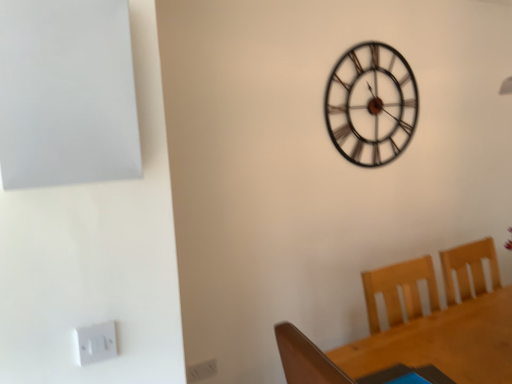
Question: Considering the relative positions of metallic black clock at upper center and white plastic electric outlet at lower left in the image provided, is metallic black clock at upper center to the left of white plastic electric outlet at lower left from the viewer's perspective?

Choices:
 (A) yes
 (B) no

Answer: (B)

Question: From the image's perspective, is metallic black clock at upper center on top of white plastic electric outlet at lower left?

Choices:
 (A) no
 (B) yes

Answer: (B)

Question: Considering the relative positions of metallic black clock at upper center and white plastic electric outlet at lower left in the image provided, is metallic black clock at upper center to the right of white plastic electric outlet at lower left from the viewer's perspective?

Choices:
 (A) yes
 (B) no

Answer: (A)

Question: From a real-world perspective, is metallic black clock at upper center located higher than white plastic electric outlet at lower left?

Choices:
 (A) no
 (B) yes

Answer: (B)

Question: Does metallic black clock at upper center have a larger size compared to white plastic electric outlet at lower left?

Choices:
 (A) yes
 (B) no

Answer: (A)

Question: From a real-world perspective, is metallic black clock at upper center physically located above or below white plastic electric outlet at lower left?

Choices:
 (A) below
 (B) above

Answer: (B)

Question: In terms of size, does metallic black clock at upper center appear bigger or smaller than white plastic electric outlet at lower left?

Choices:
 (A) small
 (B) big

Answer: (B)

Question: From the image's perspective, is metallic black clock at upper center positioned above or below white plastic electric outlet at lower left?

Choices:
 (A) below
 (B) above

Answer: (B)

Question: Is metallic black clock at upper center in front of or behind white plastic electric outlet at lower left in the image?

Choices:
 (A) front
 (B) behind

Answer: (B)

Question: Would you say wooden table at lower right is to the left or to the right of metallic black clock at upper center in the picture?

Choices:
 (A) left
 (B) right

Answer: (B)

Question: Is wooden table at lower right wider or thinner than metallic black clock at upper center?

Choices:
 (A) thin
 (B) wide

Answer: (B)

Question: Is wooden table at lower right in front of or behind metallic black clock at upper center in the image?

Choices:
 (A) front
 (B) behind

Answer: (A)

Question: From a real-world perspective, is wooden table at lower right positioned above or below metallic black clock at upper center?

Choices:
 (A) below
 (B) above

Answer: (A)

Question: From a real-world perspective, is wooden table at lower right above or below white plastic electric outlet at lower left?

Choices:
 (A) above
 (B) below

Answer: (B)

Question: Considering the positions of wooden table at lower right and white plastic electric outlet at lower left in the image, is wooden table at lower right wider or thinner than white plastic electric outlet at lower left?

Choices:
 (A) thin
 (B) wide

Answer: (B)